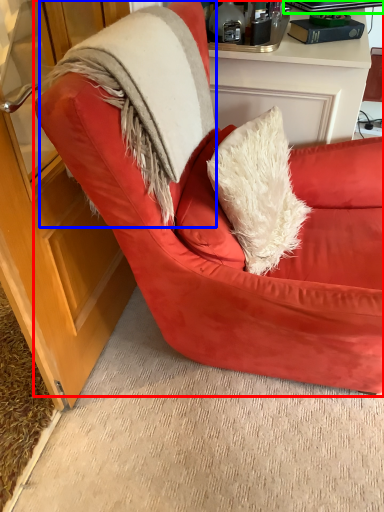
Question: Which object is the farthest from chair (highlighted by a red box)? Choose among these: fur coat (highlighted by a blue box) or laptop (highlighted by a green box).

Choices:
 (A) fur coat
 (B) laptop

Answer: (B)